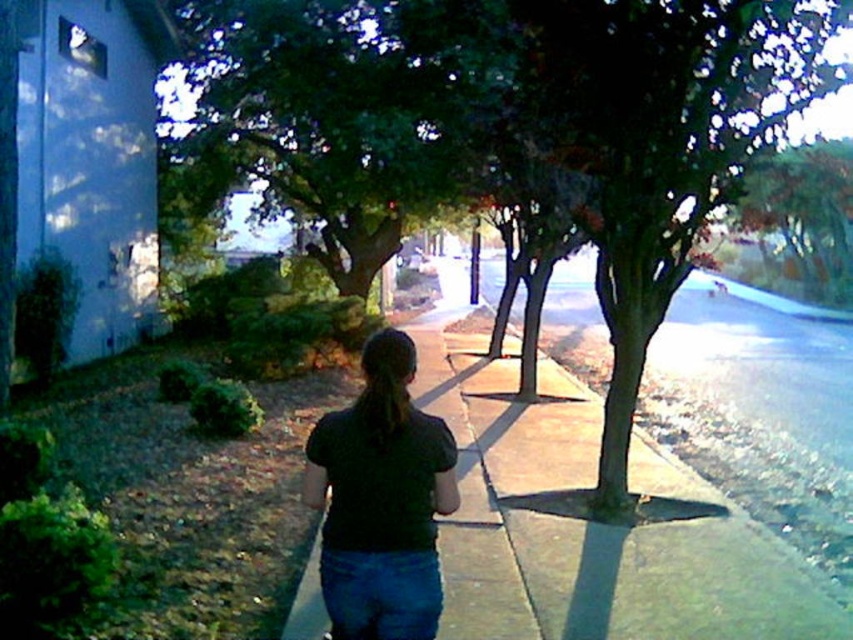
Between green leafy tree at upper center and dark matte shirt at center, which one appears on the right side from the viewer's perspective?

From the viewer's perspective, dark matte shirt at center appears more on the right side.

How far apart are green leafy tree at upper center and dark matte shirt at center?

12.12 meters

Is point (416, 26) in front of point (384, 461)?

That is False.

Where is `green leafy tree at upper center`? The height and width of the screenshot is (640, 853). green leafy tree at upper center is located at coordinates (341, 109).

Does smooth concrete sidewalk at center appear on the left side of dark matte shirt at center?

Incorrect, smooth concrete sidewalk at center is not on the left side of dark matte shirt at center.

Who is positioned more to the right, smooth concrete sidewalk at center or dark matte shirt at center?

From the viewer's perspective, smooth concrete sidewalk at center appears more on the right side.

Who is more distant from viewer, (688, 538) or (393, 337)?

Point (688, 538)

Where is `smooth concrete sidewalk at center`? This screenshot has width=853, height=640. smooth concrete sidewalk at center is located at coordinates (589, 522).

Does smooth concrete sidewalk at center have a larger size compared to blue denim jeans at center?

Correct, smooth concrete sidewalk at center is larger in size than blue denim jeans at center.

Does smooth concrete sidewalk at center have a lesser width compared to blue denim jeans at center?

Incorrect, smooth concrete sidewalk at center's width is not less than blue denim jeans at center's.

This screenshot has height=640, width=853. I want to click on smooth concrete sidewalk at center, so tap(589, 522).

Find the location of a particular element. This screenshot has height=640, width=853. smooth concrete sidewalk at center is located at coordinates (589, 522).